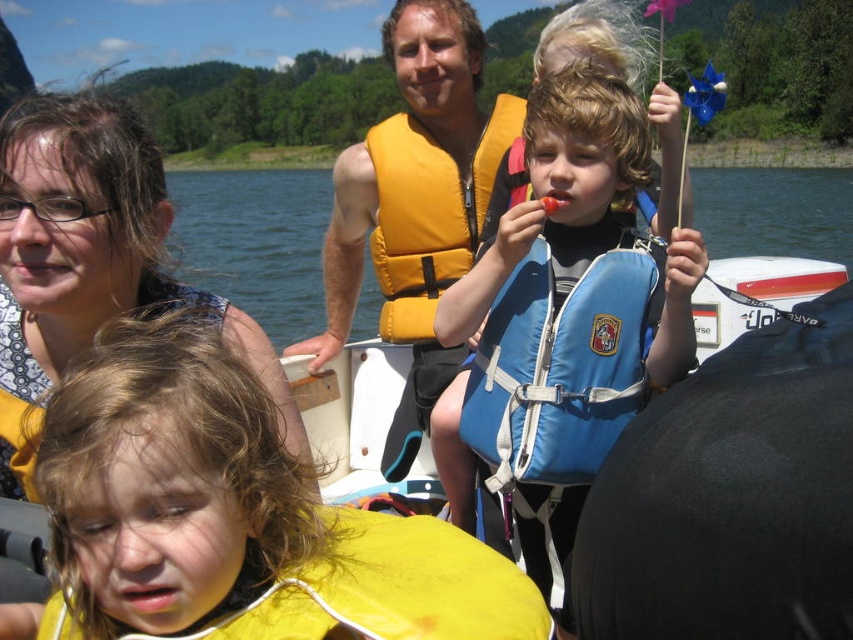
Based on the photo, does yellow life vest at lower left have a larger size compared to blue fabric life jacket at center?

Yes, yellow life vest at lower left is bigger than blue fabric life jacket at center.

Does yellow life vest at lower left have a lesser width compared to blue fabric life jacket at center?

Incorrect, yellow life vest at lower left's width is not less than blue fabric life jacket at center's.

Describe the element at coordinates (235, 516) in the screenshot. This screenshot has height=640, width=853. I see `yellow life vest at lower left` at that location.

The image size is (853, 640). I want to click on yellow life vest at lower left, so click(235, 516).

Does yellow matte life jacket at lower left appear over yellow fabric life jacket at center?

No.

Between yellow matte life jacket at lower left and yellow fabric life jacket at center, which one appears on the left side from the viewer's perspective?

Positioned to the left is yellow matte life jacket at lower left.

Is point (421, 532) positioned before point (416, 161)?

Yes, point (421, 532) is in front of point (416, 161).

This screenshot has width=853, height=640. Identify the location of yellow matte life jacket at lower left. (387, 588).

Who is positioned more to the left, blue life vest at center or matte black hair at upper left?

Positioned to the left is matte black hair at upper left.

Between point (538, 189) and point (178, 285), which one is positioned behind?

The point (538, 189) is more distant.

Does point (479, 397) lie in front of point (78, 182)?

No, it is behind (78, 182).

The height and width of the screenshot is (640, 853). What are the coordinates of `blue life vest at center` in the screenshot? It's located at (569, 314).